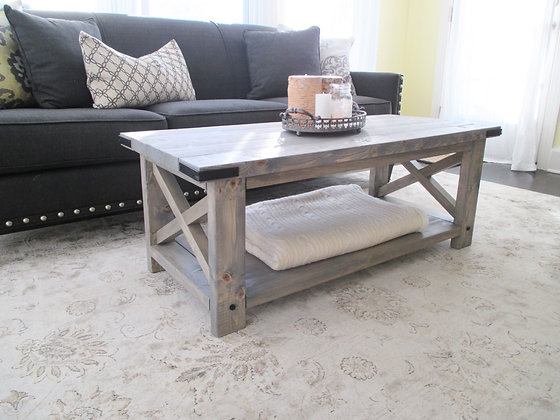
Find the location of a particular element. cushions is located at coordinates [282, 56], [136, 78], [62, 24], [16, 83].